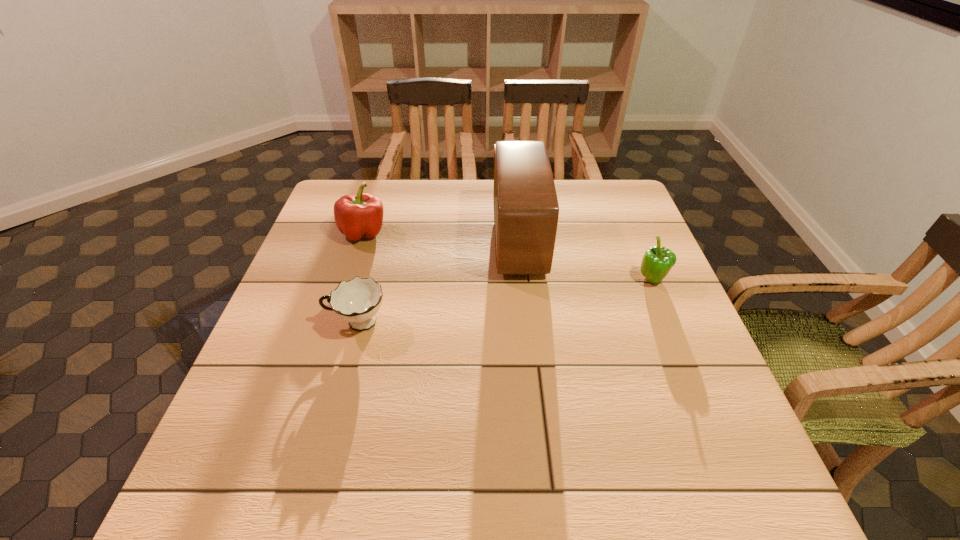
Where is `the tallest object`? The height and width of the screenshot is (540, 960). the tallest object is located at coordinates (526, 210).

Image resolution: width=960 pixels, height=540 pixels. What are the coordinates of `the second object from right to left` in the screenshot? It's located at (526, 210).

Where is `the left bell pepper`? The image size is (960, 540). the left bell pepper is located at coordinates (359, 216).

In order to click on the rightmost object in this screenshot , I will do `click(657, 261)`.

In order to click on the nearer bell pepper in this screenshot , I will do `click(657, 261)`.

Locate an element on the screen. The image size is (960, 540). the nearest object is located at coordinates (357, 301).

This screenshot has width=960, height=540. Identify the location of cup. (357, 301).

You are a GUI agent. You are given a task and a screenshot of the screen. Output one action in this format:
    pyautogui.click(x=<x>, y=<y>)
    Task: Click on the vacant region located on the front-facing side of the radio receiver
    Image resolution: width=960 pixels, height=540 pixels.
    Given the screenshot: What is the action you would take?
    pyautogui.click(x=446, y=241)

You are a GUI agent. You are given a task and a screenshot of the screen. Output one action in this format:
    pyautogui.click(x=<x>, y=<y>)
    Task: Click on the free space located on the front-facing side of the radio receiver
    The height and width of the screenshot is (540, 960).
    Given the screenshot: What is the action you would take?
    pyautogui.click(x=458, y=241)

Find the location of a particular element. The image size is (960, 540). blank space located 0.170m on the front-facing side of the radio receiver is located at coordinates (432, 241).